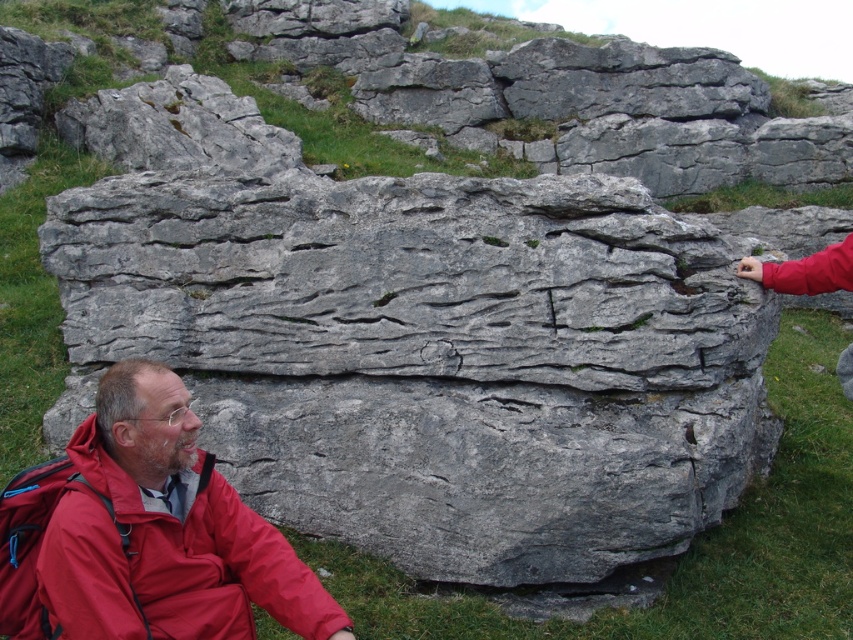
You are a hiker who has just arrived at the scene. You need to locate the gray rock at center. According to the coordinates provided, where should you look to find it?

The gray rock at center is located at coordinates point [576,102].

You are a hiker who wants to take a photo of the gray rock at center and the red nylon jacket at lower left. Which object should you focus on first if you want to capture both in the frame without moving the camera?

The gray rock at center is larger than the red nylon jacket at lower left, so you should focus on the gray rock at center first to ensure it fits properly in the frame before adjusting for the smaller object.

You are standing at the point marked by the coordinates point (x=576, y=102). What object are you directly facing in the scene?

The point (x=576, y=102) marks the gray rock at center, so you are directly facing the gray rock at center.